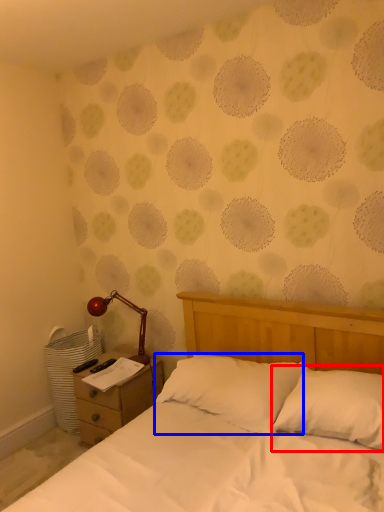
Question: Among these objects, which one is farthest to the camera, pillow (highlighted by a red box) or pillow (highlighted by a blue box)?

Choices:
 (A) pillow
 (B) pillow

Answer: (B)